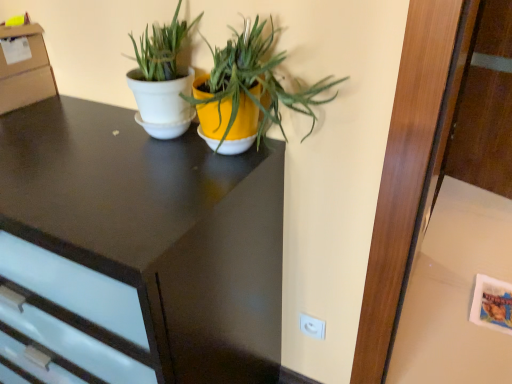
The height and width of the screenshot is (384, 512). Identify the location of free space in front of white glossy pot at center, marked as the second houseplant in a right-to-left arrangement. (132, 167).